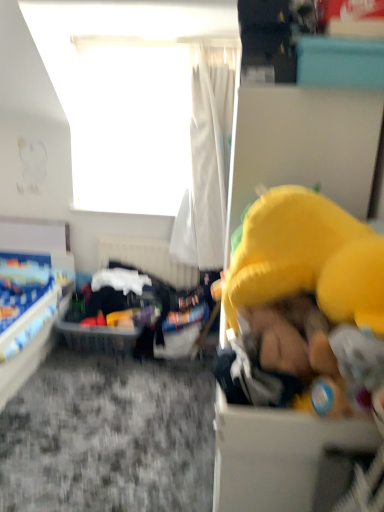
Question: Should I look upward or downward to see blue fabric bed at lower left?

Choices:
 (A) down
 (B) up

Answer: (A)

Question: Considering the relative sizes of yellow plush toy at right and white fabric bed frame at center in the image provided, is yellow plush toy at right wider than white fabric bed frame at center?

Choices:
 (A) yes
 (B) no

Answer: (A)

Question: Is yellow plush toy at right positioned before white fabric bed frame at center?

Choices:
 (A) yes
 (B) no

Answer: (A)

Question: Does yellow plush toy at right have a lesser width compared to white fabric bed frame at center?

Choices:
 (A) no
 (B) yes

Answer: (A)

Question: Is white fabric bed frame at center inside yellow plush toy at right?

Choices:
 (A) no
 (B) yes

Answer: (A)

Question: From a real-world perspective, is yellow plush toy at right below white fabric bed frame at center?

Choices:
 (A) no
 (B) yes

Answer: (A)

Question: Considering the relative sizes of yellow plush toy at right and white fabric bed frame at center in the image provided, is yellow plush toy at right smaller than white fabric bed frame at center?

Choices:
 (A) yes
 (B) no

Answer: (B)

Question: Considering the relative positions of white sheer curtain at upper center and yellow fabric toy at right, the second box from the top, in the image provided, is white sheer curtain at upper center to the left of yellow fabric toy at right, the second box from the top, from the viewer's perspective?

Choices:
 (A) no
 (B) yes

Answer: (B)

Question: Is white sheer curtain at upper center positioned with its back to yellow fabric toy at right, the first box from the left?

Choices:
 (A) yes
 (B) no

Answer: (B)

Question: Does white sheer curtain at upper center have a lesser width compared to yellow fabric toy at right, the 1th box viewed from the front?

Choices:
 (A) no
 (B) yes

Answer: (A)

Question: From a real-world perspective, is white sheer curtain at upper center on top of yellow fabric toy at right, the 1th box viewed from the front?

Choices:
 (A) no
 (B) yes

Answer: (B)

Question: Is yellow fabric toy at right, the 1th box viewed from the front, inside white sheer curtain at upper center?

Choices:
 (A) no
 (B) yes

Answer: (A)

Question: From the image's perspective, does white sheer curtain at upper center appear lower than yellow fabric toy at right, the second box from the top?

Choices:
 (A) yes
 (B) no

Answer: (B)

Question: Is translucent plastic basket at center at the left side of yellow plush toy at right?

Choices:
 (A) yes
 (B) no

Answer: (A)